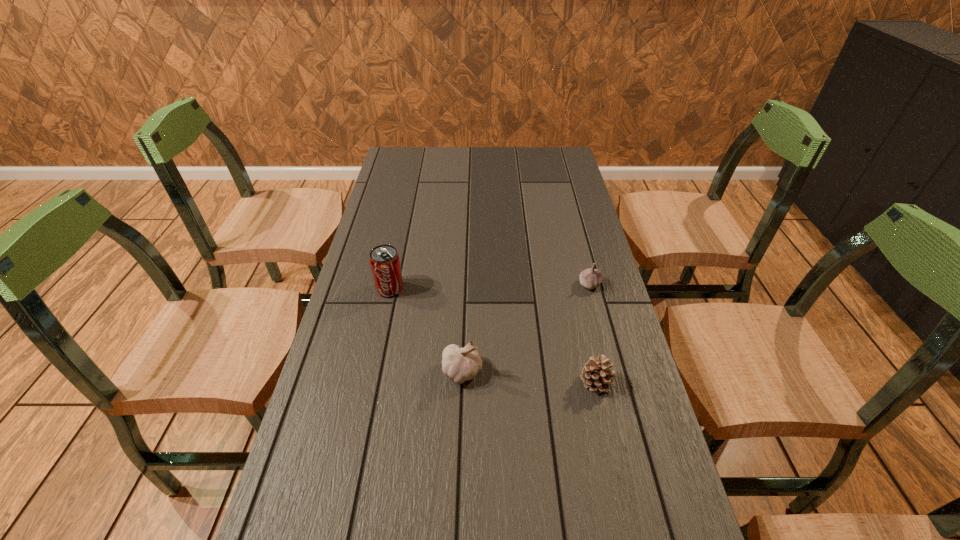
Where is `vacant area between the shorter garlic and the nearer garlic`? Image resolution: width=960 pixels, height=540 pixels. vacant area between the shorter garlic and the nearer garlic is located at coordinates (526, 328).

Where is `vacant point located between the shorter garlic and the pinecone`? The width and height of the screenshot is (960, 540). vacant point located between the shorter garlic and the pinecone is located at coordinates (593, 334).

Where is `free spot between the pinecone and the third object from right to left`? The width and height of the screenshot is (960, 540). free spot between the pinecone and the third object from right to left is located at coordinates (529, 377).

Where is `vacant area that lies between the farther garlic and the pinecone`? This screenshot has height=540, width=960. vacant area that lies between the farther garlic and the pinecone is located at coordinates (593, 334).

This screenshot has width=960, height=540. Identify the location of free space between the leftmost object and the shorter garlic. (490, 286).

Locate an element on the screen. free space that is in between the leftmost object and the farther garlic is located at coordinates point(490,286).

Identify which object is located as the second nearest to the farther garlic. Please provide its 2D coordinates. Your answer should be formatted as a tuple, i.e. [(x, y)], where the tuple contains the x and y coordinates of a point satisfying the conditions above.

[(460, 364)]

Identify which object is the third closest to the pinecone. Please provide its 2D coordinates. Your answer should be formatted as a tuple, i.e. [(x, y)], where the tuple contains the x and y coordinates of a point satisfying the conditions above.

[(385, 265)]

At what (x,y) coordinates should I click in order to perform the action: click on free space that satisfies the following two spatial constraints: 1. on the front side of the left garlic; 2. on the left side of the leftmost object. Please return your answer as a coordinate pair (x, y). This screenshot has height=540, width=960. Looking at the image, I should click on (372, 372).

This screenshot has height=540, width=960. In order to click on free spot that satisfies the following two spatial constraints: 1. on the back side of the right garlic; 2. on the right side of the nearer garlic in this screenshot , I will do point(466,284).